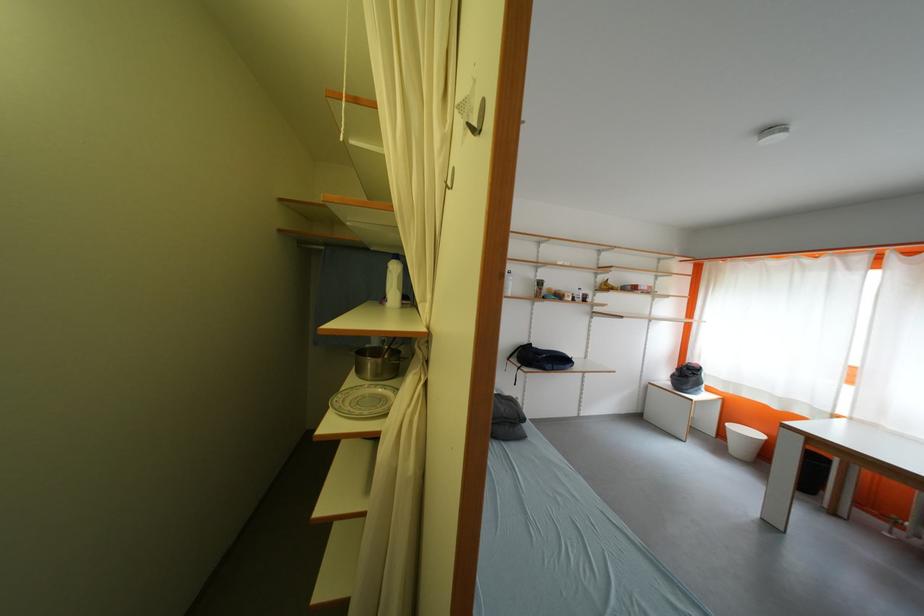
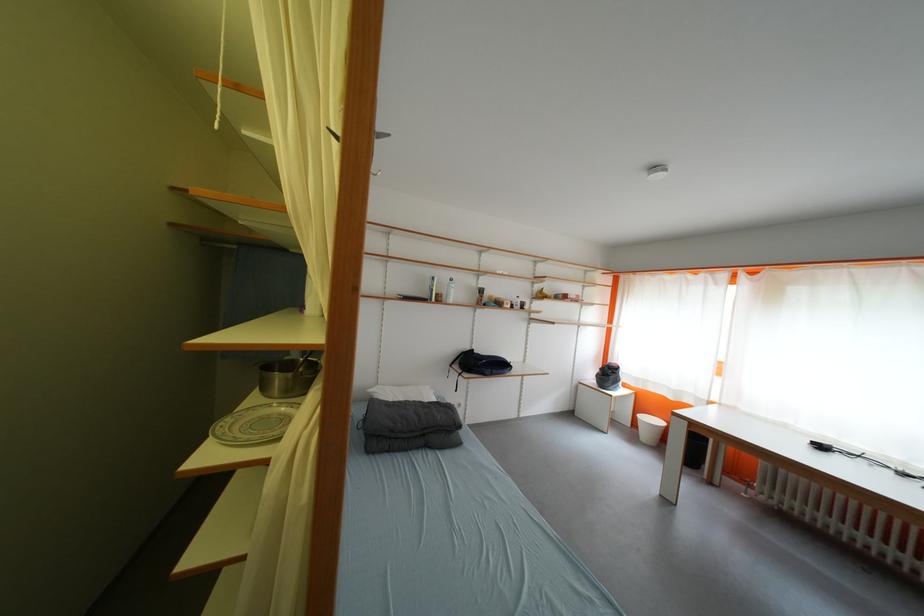
Locate, in the second image, the point that corresponds to pixel 523 363 in the first image.

(466, 370)